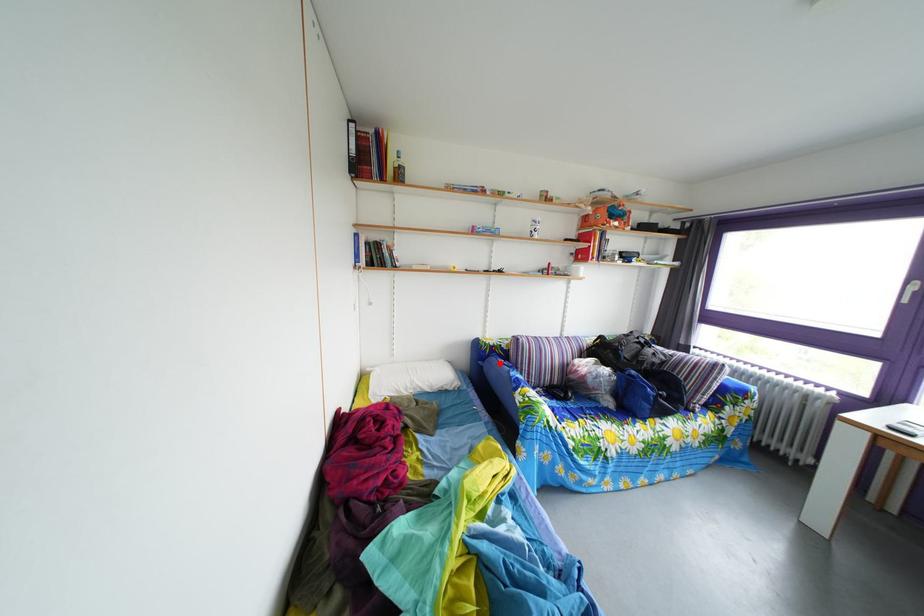
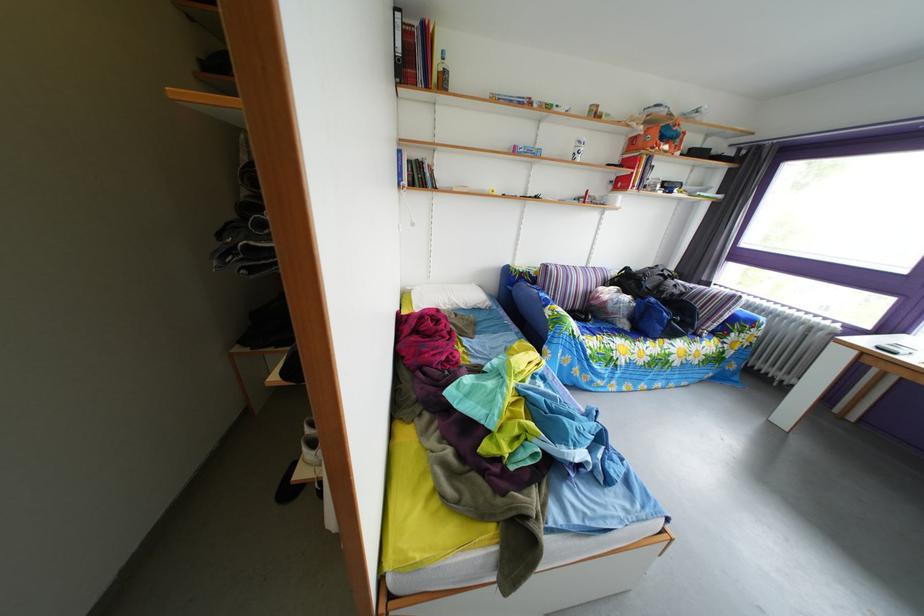
Question: I am providing you with two images of the same scene from different viewpoints. A red point is shown in image1. For the corresponding object point in image2, is it positioned nearer or farther from the camera?

Choices:
 (A) Nearer
 (B) Farther

Answer: (A)